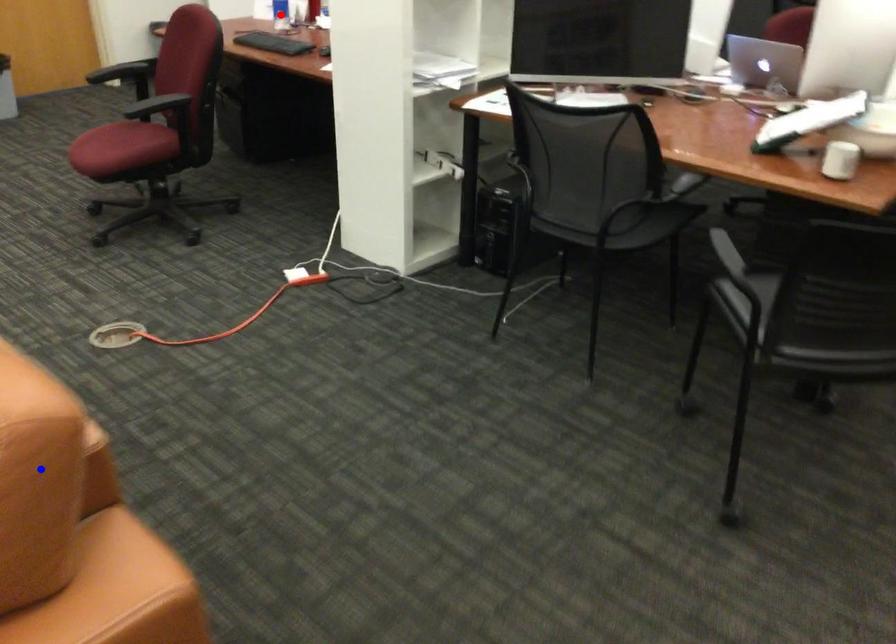
Question: In the image, two points are highlighted. Which point is nearer to the camera? Reply with the corresponding letter.

Choices:
 (A) blue point
 (B) red point

Answer: (A)